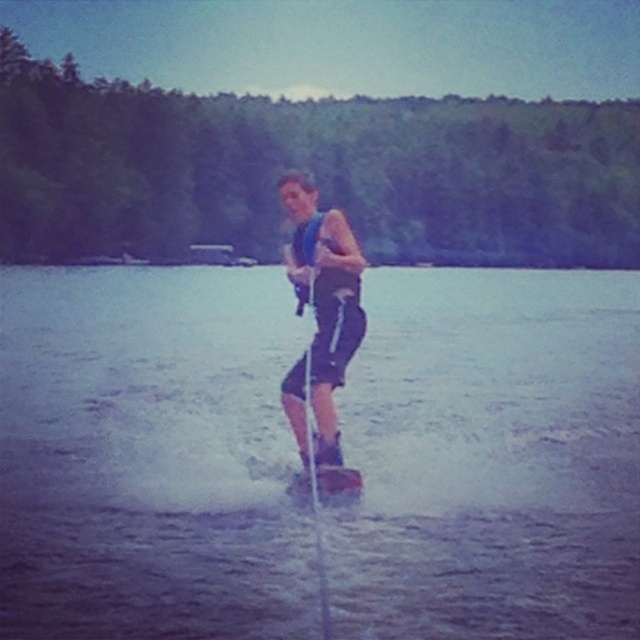
Question: Does clear water at center appear on the right side of blue fabric life vest at center?

Choices:
 (A) no
 (B) yes

Answer: (B)

Question: Which point is closer to the camera taking this photo?

Choices:
 (A) (218, 296)
 (B) (340, 317)

Answer: (B)

Question: Can you confirm if clear water at center is bigger than blue fabric life vest at center?

Choices:
 (A) no
 (B) yes

Answer: (B)

Question: Is clear water at center to the left of blue fabric life vest at center from the viewer's perspective?

Choices:
 (A) no
 (B) yes

Answer: (A)

Question: Which point appears farthest from the camera in this image?

Choices:
 (A) (300, 296)
 (B) (36, 458)

Answer: (B)